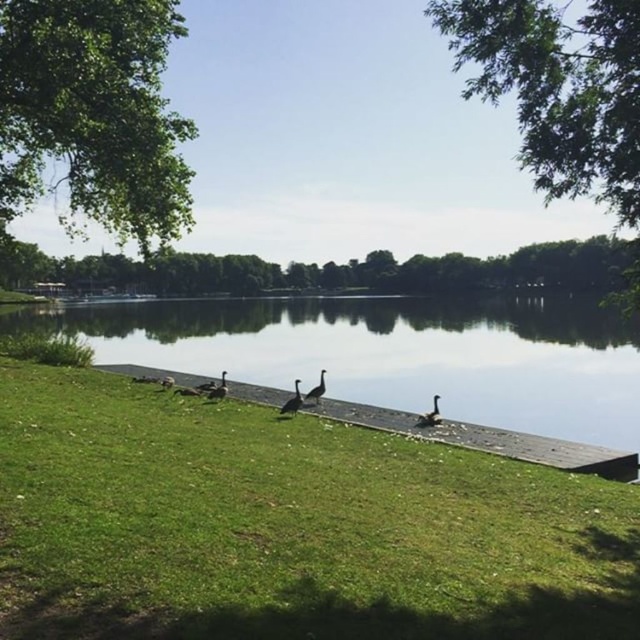
Can you confirm if green leafy tree at upper right is smaller than dark gray feathered duck at center?

Actually, green leafy tree at upper right might be larger than dark gray feathered duck at center.

What do you see at coordinates (560, 88) in the screenshot? Image resolution: width=640 pixels, height=640 pixels. I see `green leafy tree at upper right` at bounding box center [560, 88].

Image resolution: width=640 pixels, height=640 pixels. What are the coordinates of `green leafy tree at upper right` in the screenshot? It's located at (560, 88).

Does dark gray feathered duck at center appear on the left side of dark gray feathers at center?

No, dark gray feathered duck at center is not to the left of dark gray feathers at center.

Is dark gray feathered duck at center thinner than dark gray feathers at center?

In fact, dark gray feathered duck at center might be wider than dark gray feathers at center.

Is point (433, 424) behind point (296, 380)?

No, it is not.

Find the location of a particular element. dark gray feathered duck at center is located at coordinates (429, 416).

Does green leafy tree at upper right have a greater height compared to brown feathered duck at center?

Correct, green leafy tree at upper right is much taller as brown feathered duck at center.

Can you confirm if green leafy tree at upper right is smaller than brown feathered duck at center?

Actually, green leafy tree at upper right might be larger than brown feathered duck at center.

This screenshot has width=640, height=640. Describe the element at coordinates (560, 88) in the screenshot. I see `green leafy tree at upper right` at that location.

Image resolution: width=640 pixels, height=640 pixels. In order to click on green leafy tree at upper right in this screenshot , I will do `click(560, 88)`.